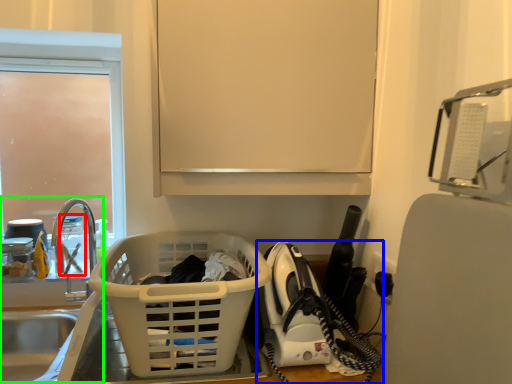
Question: Considering the real-world distances, which object is closest to bottle (highlighted by a red box)? home appliance (highlighted by a blue box) or sink (highlighted by a green box).

Choices:
 (A) home appliance
 (B) sink

Answer: (B)